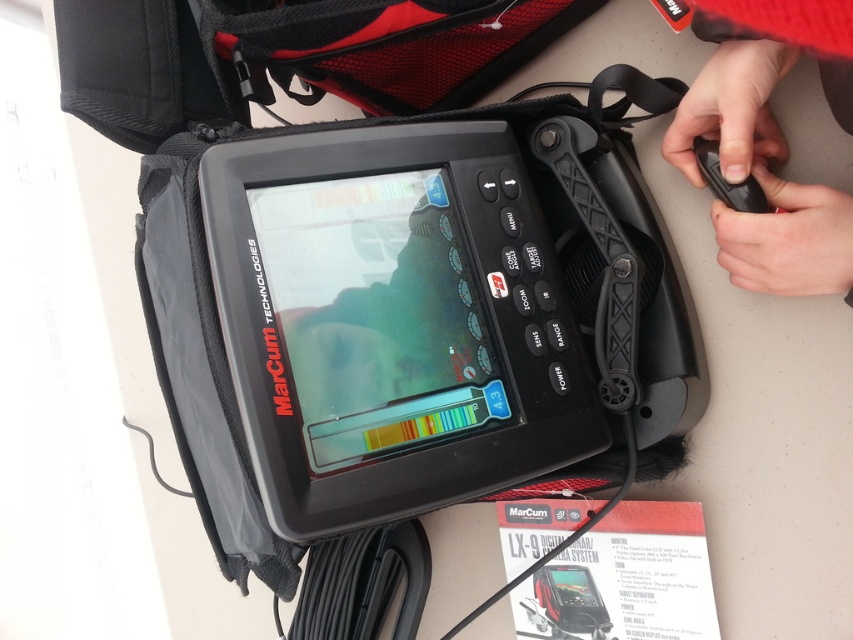
Question: Does black matte remote control at upper right have a smaller size compared to black rubber remote control at upper right?

Choices:
 (A) yes
 (B) no

Answer: (B)

Question: Considering the relative positions of black matte remote control at upper right and black rubber remote control at upper right in the image provided, where is black matte remote control at upper right located with respect to black rubber remote control at upper right?

Choices:
 (A) below
 (B) above

Answer: (B)

Question: Among these points, which one is nearest to the camera?

Choices:
 (A) (705, 179)
 (B) (811, 40)

Answer: (B)

Question: Which point is farther to the camera?

Choices:
 (A) black matte remote control at upper right
 (B) black rubber remote control at upper right

Answer: (B)

Question: Is black matte remote control at upper right to the right of black rubber remote control at upper right from the viewer's perspective?

Choices:
 (A) no
 (B) yes

Answer: (B)